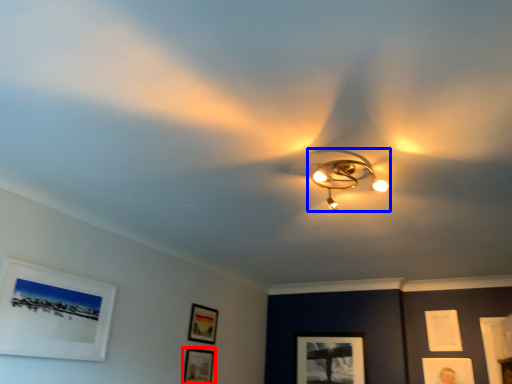
Question: Which of the following is the closest to the observer, picture frame (highlighted by a red box) or lamp (highlighted by a blue box)?

Choices:
 (A) picture frame
 (B) lamp

Answer: (B)